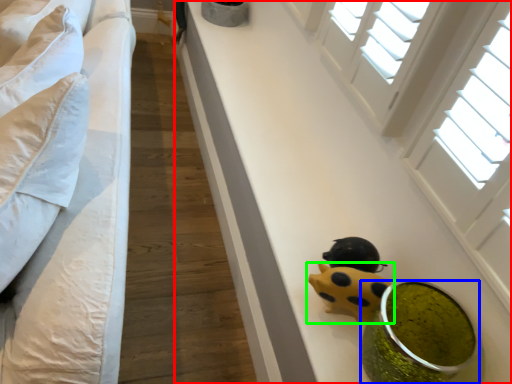
Question: Which object is positioned farthest from table (highlighted by a red box)? Select from food (highlighted by a blue box) and toy (highlighted by a green box).

Choices:
 (A) food
 (B) toy

Answer: (B)